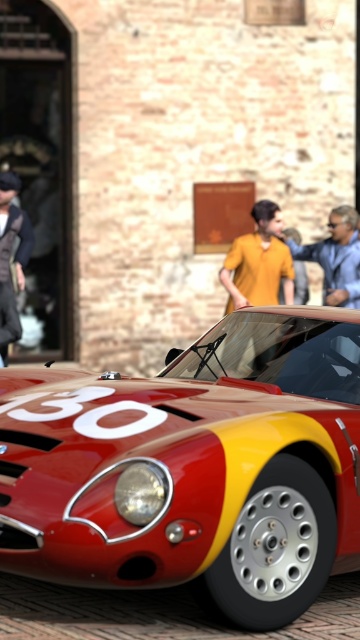
Question: Is shiny red and yellow sports car at center wider than matte yellow shirt at center?

Choices:
 (A) no
 (B) yes

Answer: (B)

Question: Which object appears closest to the camera in this image?

Choices:
 (A) matte yellow shirt at center
 (B) yellow matte shirt at center
 (C) leather jacket at left
 (D) shiny red and yellow sports car at center

Answer: (D)

Question: Can you confirm if shiny red and yellow sports car at center is positioned to the right of leather jacket at left?

Choices:
 (A) no
 (B) yes

Answer: (B)

Question: Which point is closer to the camera?

Choices:
 (A) (15, 337)
 (B) (263, 282)
 (C) (344, 280)
 (D) (142, 412)

Answer: (D)

Question: Can you confirm if shiny red and yellow sports car at center is positioned to the right of yellow matte shirt at center?

Choices:
 (A) yes
 (B) no

Answer: (B)

Question: Which object is farther from the camera taking this photo?

Choices:
 (A) yellow matte shirt at center
 (B) leather jacket at left
 (C) shiny red and yellow sports car at center
 (D) matte yellow shirt at center

Answer: (B)